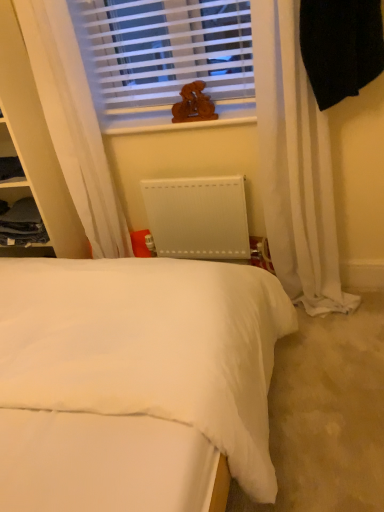
This screenshot has height=512, width=384. I want to click on vacant space underneath white plastic blinds at upper center (from a real-world perspective), so click(185, 116).